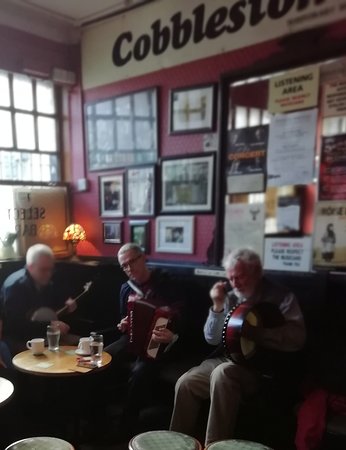
Find the location of a particular element. drinking cups is located at coordinates (39, 343), (52, 333), (97, 348), (83, 348).